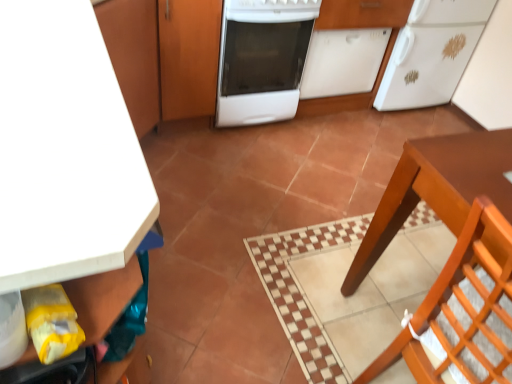
Locate an element on the screen. The height and width of the screenshot is (384, 512). blank space above white matte cabinet at upper left, which is counted as the second cabinetry, starting from the left (from a real-world perspective) is located at coordinates (47, 79).